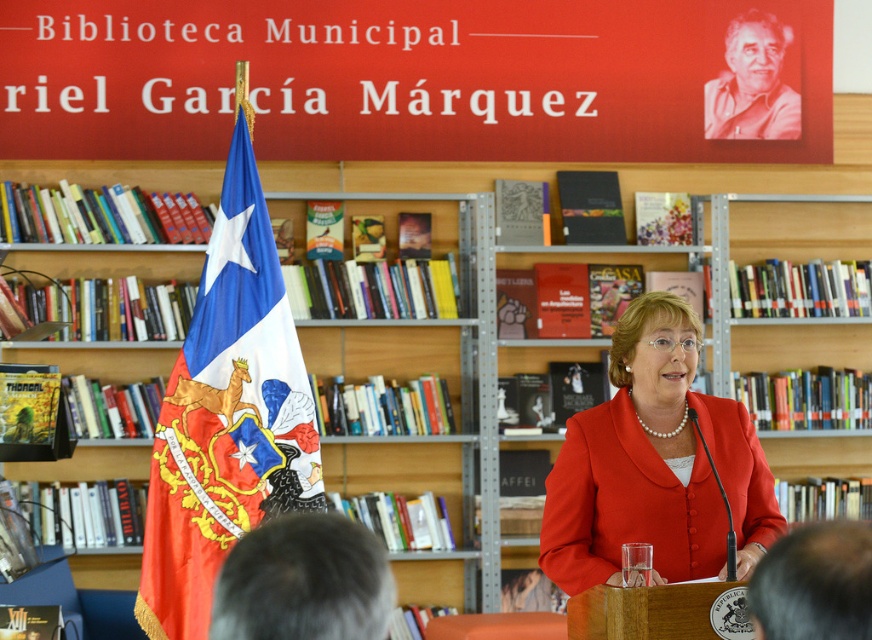
You are an event organizer at the Biblioteca Municipal. You need to determine which object is taller between the red fabric flag at left and the matte red blazer at center. Based on the scene, which one is taller?

The red fabric flag at left is taller than the matte red blazer at center.

You are an event planner at the Biblioteca Municipal and need to place a new decorative item on the wooden bookshelf at center. According to the library layout, the bookshelf is located at coordinates 0.319 on the x and 0.888 on the y. If the library uses a coordinate system where the bottom left corner is the origin, where would you place the item to ensure it is centered on the bookshelf?

To center the decorative item on the wooden bookshelf at center, place it at the coordinates provided, which are already the center point of the bookshelf according to the library layout. The coordinates given are 0.319 on the x and 0.888 on the y, so placing the item there will ensure it is centered.